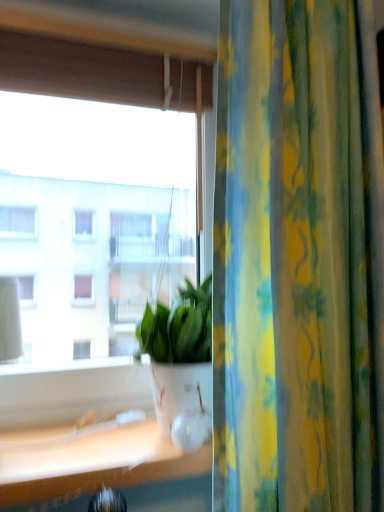
Question: From the image's perspective, is transparent glass window at center above or below white glossy pot at center?

Choices:
 (A) above
 (B) below

Answer: (A)

Question: In the image, is transparent glass window at center on the left side or the right side of white glossy pot at center?

Choices:
 (A) left
 (B) right

Answer: (A)

Question: Based on their relative distances, which object is nearer to the yellow-green floral fabric curtain at right?

Choices:
 (A) white glossy pot at center
 (B) transparent glass window at center

Answer: (A)

Question: Estimate the real-world distances between objects in this image. Which object is closer to the yellow-green floral fabric curtain at right?

Choices:
 (A) transparent glass window at center
 (B) white glossy pot at center

Answer: (B)